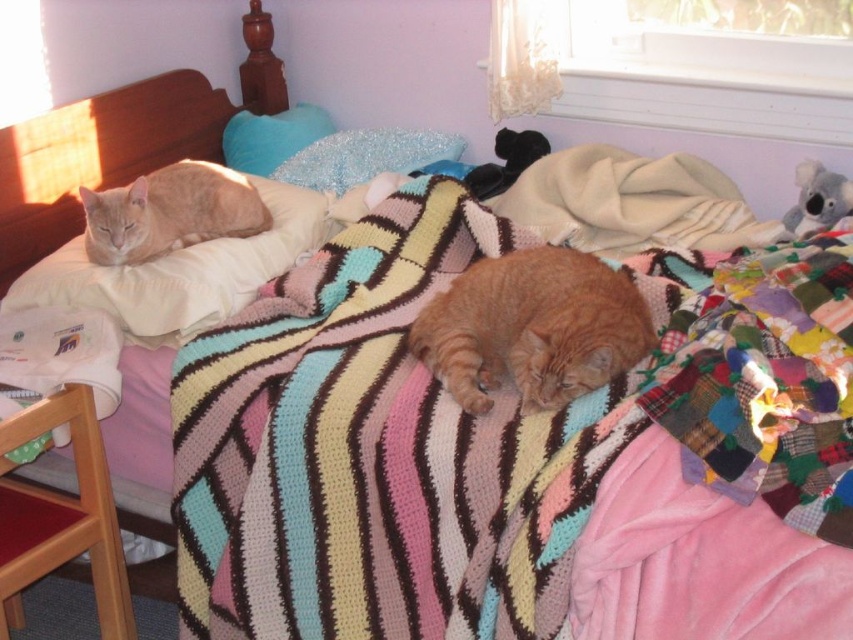
I want to click on orange fur tabby cat at center, so click(532, 326).

This screenshot has width=853, height=640. I want to click on orange fur tabby cat at center, so click(532, 326).

Does orange fur tabby cat at center have a lesser width compared to white soft pillow at upper left?

Yes, orange fur tabby cat at center is thinner than white soft pillow at upper left.

Who is positioned more to the right, orange fur tabby cat at center or white soft pillow at upper left?

orange fur tabby cat at center

Who is more distant from viewer, [541,404] or [262,188]?

The point [262,188] is behind.

This screenshot has height=640, width=853. What are the coordinates of `orange fur tabby cat at center` in the screenshot? It's located at (532, 326).

Does white soft pillow at upper left appear on the left side of orange fur cat at upper left?

No, white soft pillow at upper left is not to the left of orange fur cat at upper left.

Which is behind, point (300, 205) or point (178, 228)?

Positioned behind is point (300, 205).

Is point (238, 308) positioned before point (109, 259)?

Yes, point (238, 308) is closer to viewer.

The image size is (853, 640). Find the location of `white soft pillow at upper left`. white soft pillow at upper left is located at coordinates point(183,269).